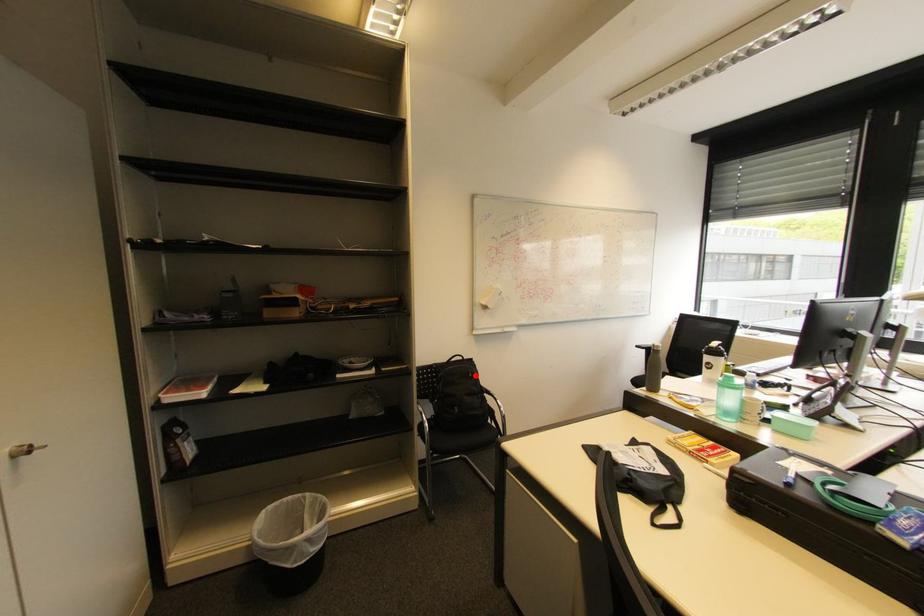
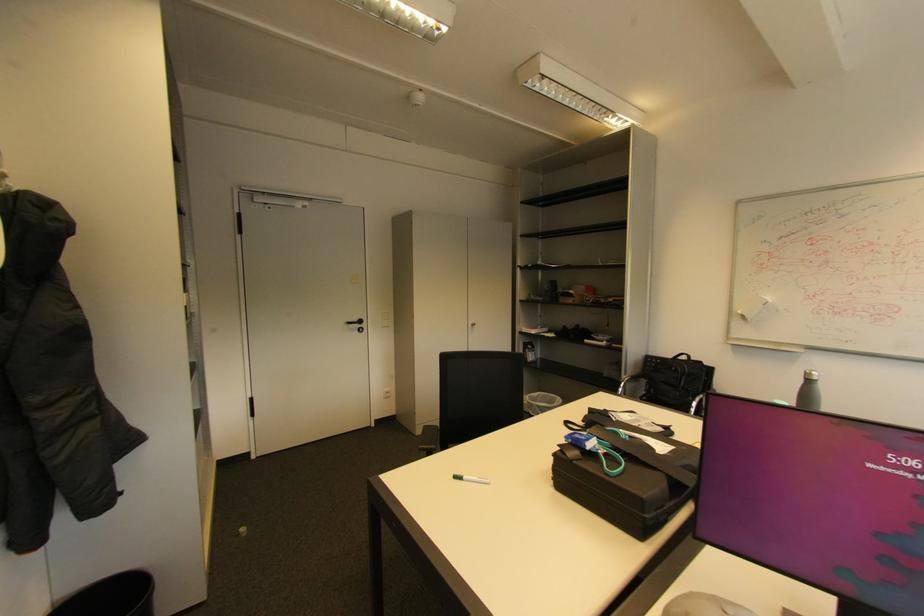
Locate, in the second image, the point that corresponds to the highlighted location in the first image.

(678, 369)